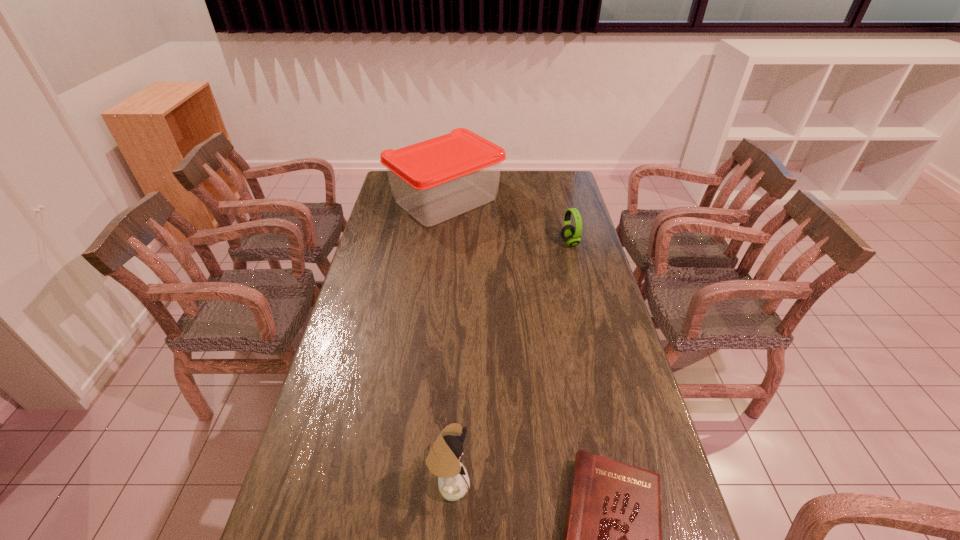
Identify the location of object that is at the far left corner. (435, 180).

Find the location of a particular element. Image resolution: width=960 pixels, height=540 pixels. vacant space at the left edge of the desktop is located at coordinates (330, 488).

In order to click on free space between the farthest object and the second farthest object in this screenshot , I will do `click(508, 221)`.

Where is `free space between the farthest object and the second shortest object`? free space between the farthest object and the second shortest object is located at coordinates (508, 221).

Image resolution: width=960 pixels, height=540 pixels. I want to click on vacant area between the tray and the doll, so click(x=447, y=342).

The height and width of the screenshot is (540, 960). In order to click on vacant area that lies between the tray and the headset in this screenshot , I will do `click(508, 221)`.

Where is `free spot between the second farthest object and the doll`? The height and width of the screenshot is (540, 960). free spot between the second farthest object and the doll is located at coordinates (510, 363).

Choose which object is the second nearest neighbor to the farthest object. Please provide its 2D coordinates. Your answer should be formatted as a tuple, i.e. [(x, y)], where the tuple contains the x and y coordinates of a point satisfying the conditions above.

[(443, 460)]

Choose which object is the nearest neighbor to the shortest object. Please provide its 2D coordinates. Your answer should be formatted as a tuple, i.e. [(x, y)], where the tuple contains the x and y coordinates of a point satisfying the conditions above.

[(443, 460)]

Locate an element on the screen. The image size is (960, 540). vacant space that satisfies the following two spatial constraints: 1. on the front side of the headset; 2. on the right side of the farthest object is located at coordinates (442, 242).